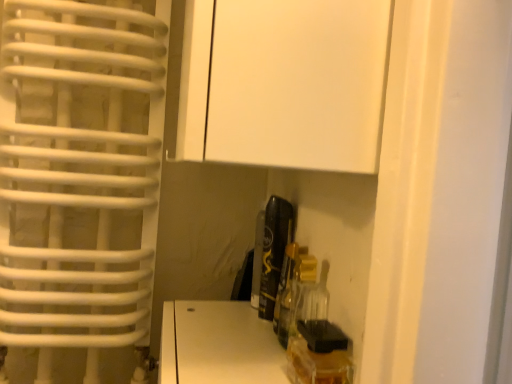
You are a GUI agent. You are given a task and a screenshot of the screen. Output one action in this format:
    pyautogui.click(x=<x>, y=<y>)
    Task: Click on the white matte cabinet at upper center
    The width and height of the screenshot is (512, 384).
    Given the screenshot: What is the action you would take?
    pyautogui.click(x=284, y=83)

What is the approximate width of white matte cabinet at upper center?

white matte cabinet at upper center is 8.87 inches in width.

The width and height of the screenshot is (512, 384). What do you see at coordinates (284, 83) in the screenshot?
I see `white matte cabinet at upper center` at bounding box center [284, 83].

This screenshot has width=512, height=384. I want to click on white matte cabinet at upper center, so click(x=284, y=83).